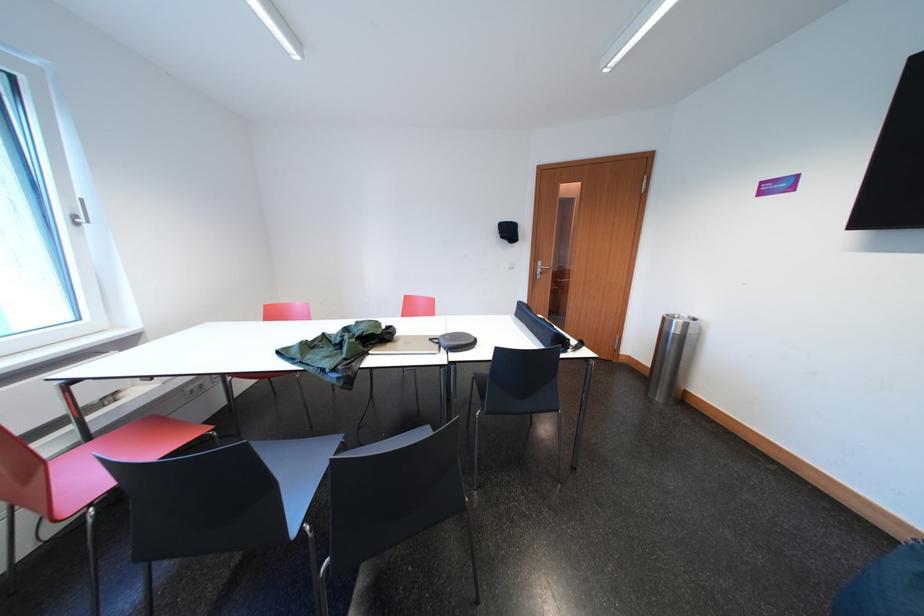
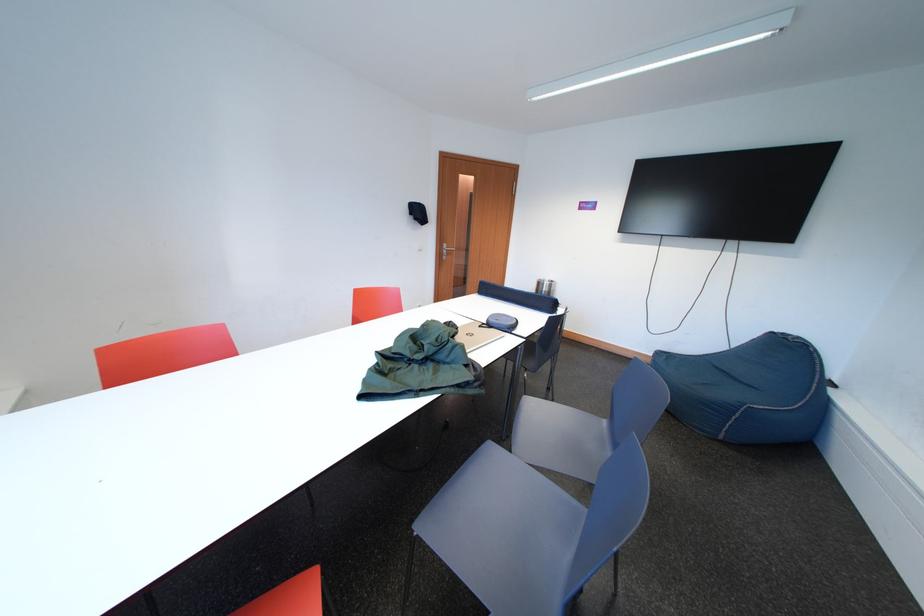
Where in the second image is the point corresponding to (x=675, y=325) from the first image?

(549, 288)